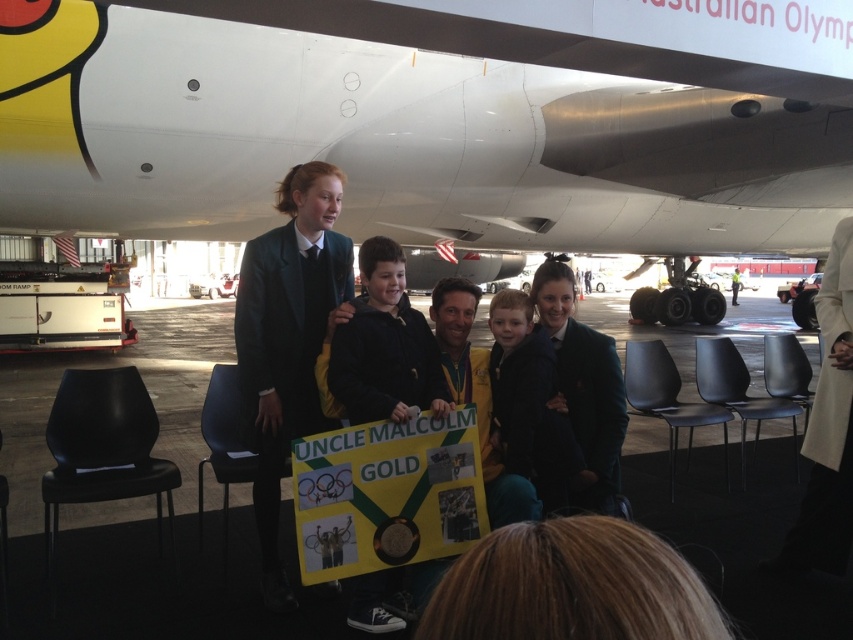
Question: Estimate the real-world distances between objects in this image. Which object is farther from the black woolen blazer at center?

Choices:
 (A) dark blue jacket at center
 (B) matte black suit at center
 (C) metallic silver airplane at center
 (D) gold medal at center

Answer: (C)

Question: Among these points, which one is nearest to the camera?

Choices:
 (A) (x=553, y=426)
 (B) (x=561, y=385)
 (C) (x=289, y=252)
 (D) (x=122, y=209)

Answer: (A)

Question: Where is dark blue jacket at center located in relation to black woolen blazer at center in the image?

Choices:
 (A) above
 (B) below

Answer: (A)

Question: Does matte black suit at center appear on the left side of black woolen blazer at center?

Choices:
 (A) no
 (B) yes

Answer: (B)

Question: Which point is closer to the camera taking this photo?

Choices:
 (A) (538, 403)
 (B) (486, 445)

Answer: (A)

Question: Is dark blue jacket at center closer to camera compared to gold medal at center?

Choices:
 (A) no
 (B) yes

Answer: (A)